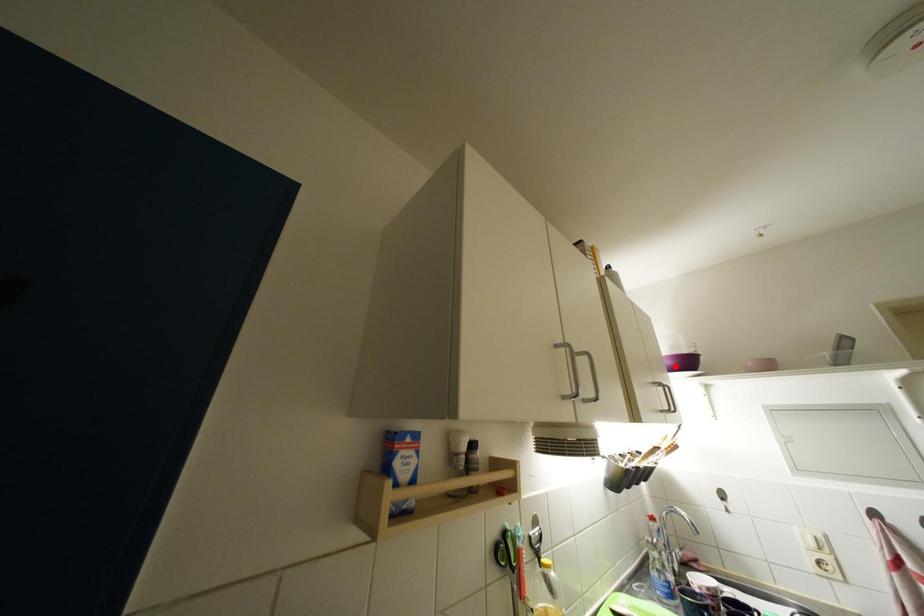
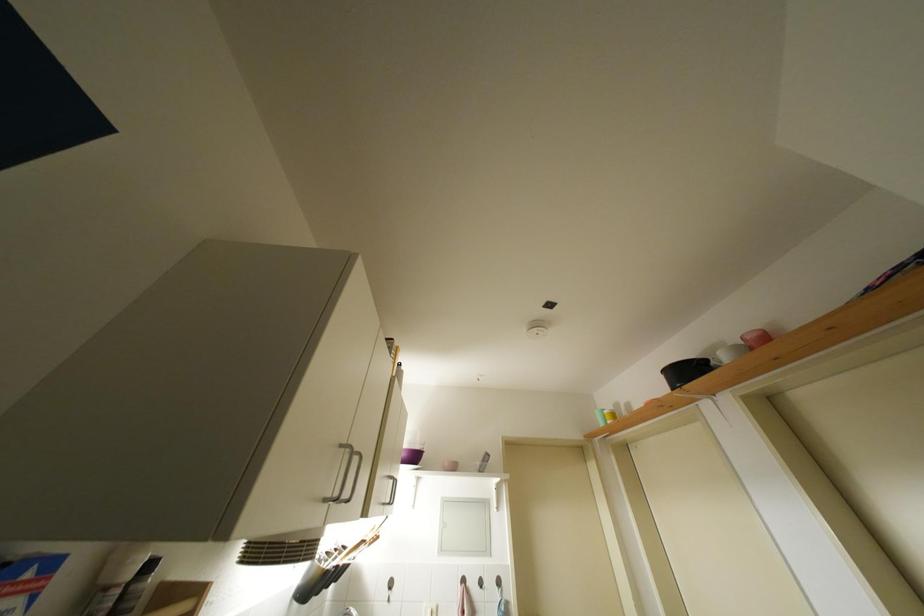
The point at the highlighted location is marked in the first image. Where is the corresponding point in the second image?

(410, 459)